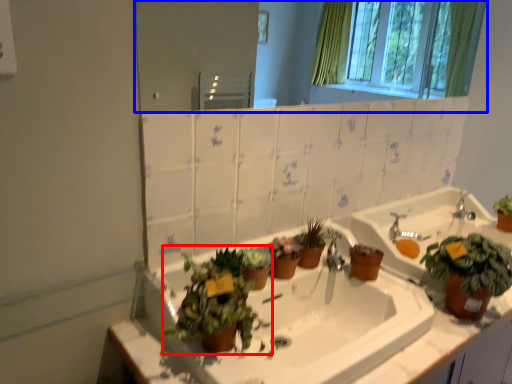
Question: Among these objects, which one is farthest to the camera, houseplant (highlighted by a red box) or mirror (highlighted by a blue box)?

Choices:
 (A) houseplant
 (B) mirror

Answer: (B)